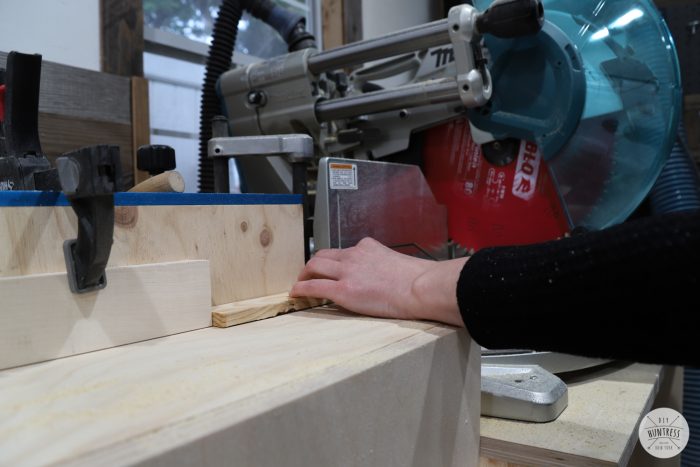
This screenshot has width=700, height=467. I want to click on top of work bench, so click(x=200, y=361).